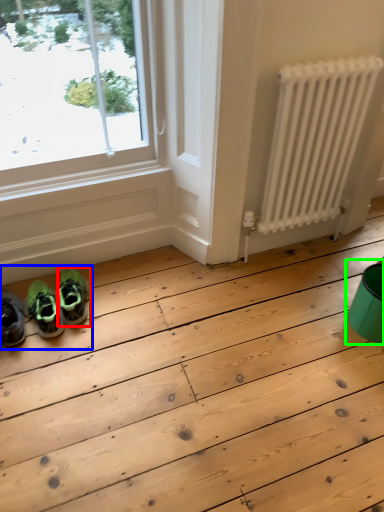
Question: Which object is the closest to the footwear (highlighted by a red box)? Choose among these: couple (highlighted by a blue box) or teal (highlighted by a green box).

Choices:
 (A) couple
 (B) teal

Answer: (A)